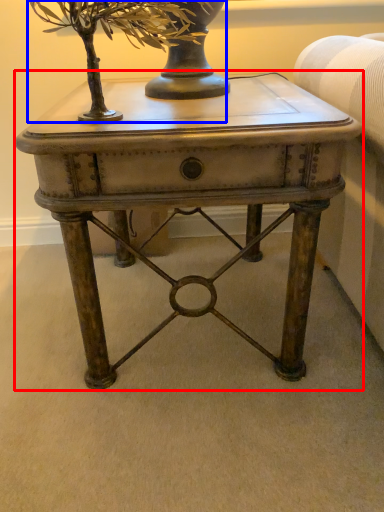
Question: Which object appears closest to the camera in this image, table (highlighted by a red box) or tree (highlighted by a blue box)?

Choices:
 (A) table
 (B) tree

Answer: (B)